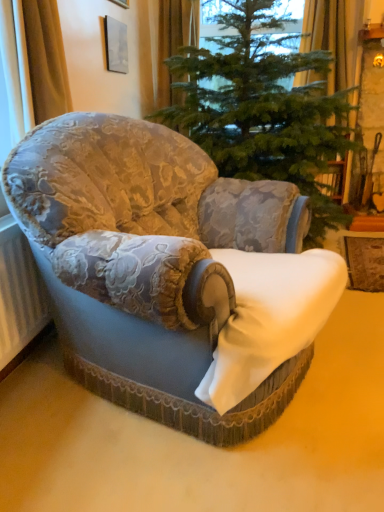
Find the location of a particular element. This screenshot has width=384, height=512. space that is in front of white textured radiator at lower left is located at coordinates click(x=33, y=419).